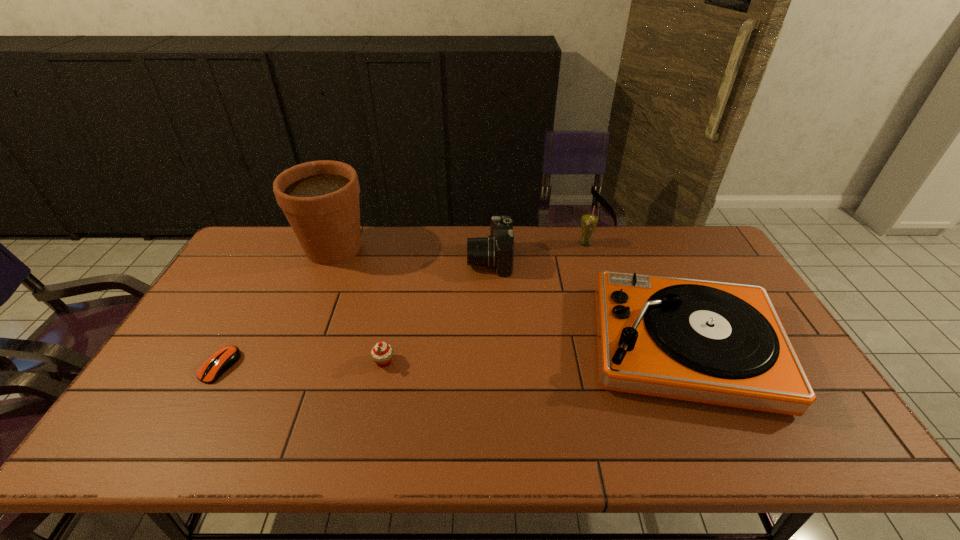
Where is `object that ranks as the fifth closest to the fourth object from right to left`? object that ranks as the fifth closest to the fourth object from right to left is located at coordinates (589, 221).

This screenshot has height=540, width=960. I want to click on object that can be found as the fifth closest to the cupcake, so click(589, 221).

Find the location of a particular element. free space that satisfies the following two spatial constraints: 1. on the front side of the second shortest object; 2. on the right side of the fifth object from right to left is located at coordinates (287, 361).

Locate an element on the screen. vacant space that satisfies the following two spatial constraints: 1. on the front side of the cupcake; 2. on the left side of the tallest object is located at coordinates (287, 361).

You are a GUI agent. You are given a task and a screenshot of the screen. Output one action in this format:
    pyautogui.click(x=<x>, y=<y>)
    Task: Click on the vacant space that satisfies the following two spatial constraints: 1. on the back side of the straw for drinking; 2. on the left side of the flowerpot
    
    Given the screenshot: What is the action you would take?
    pyautogui.click(x=336, y=244)

This screenshot has height=540, width=960. I want to click on vacant space that satisfies the following two spatial constraints: 1. on the lens of the record player; 2. on the right side of the fourth object from left to right, so click(492, 345).